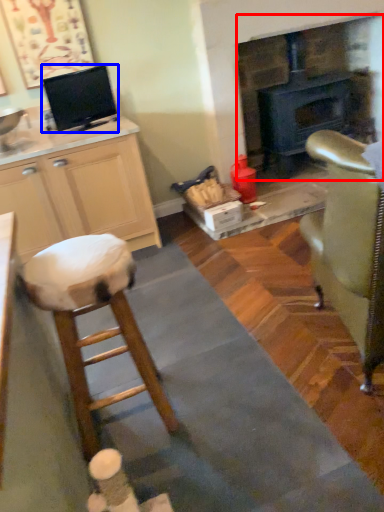
Question: Among these objects, which one is nearest to the camera, fireplace (highlighted by a red box) or appliance (highlighted by a blue box)?

Choices:
 (A) fireplace
 (B) appliance

Answer: (B)